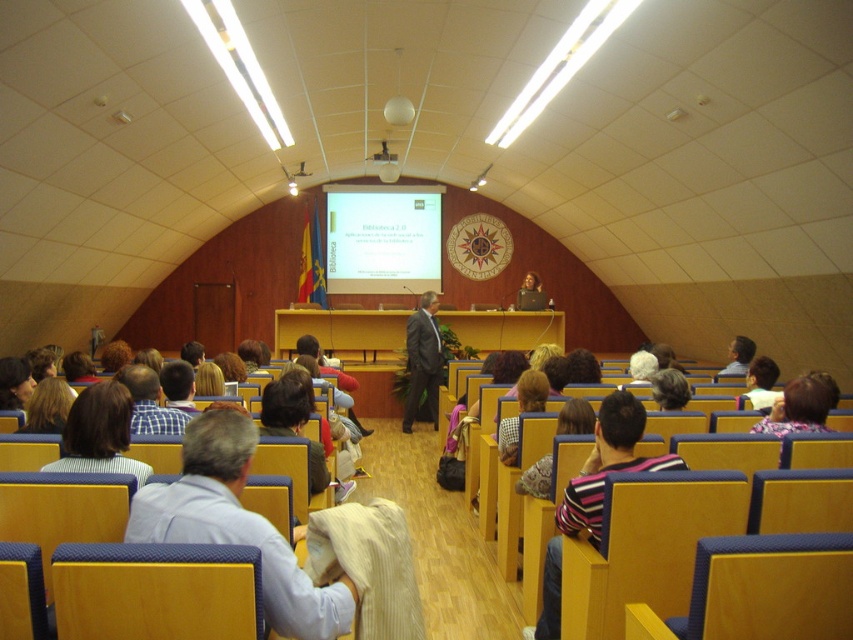
Find the location of `striped shirt at lower left`. striped shirt at lower left is located at coordinates (99, 433).

Describe the element at coordinates (99, 433) in the screenshot. This screenshot has height=640, width=853. I see `striped shirt at lower left` at that location.

The height and width of the screenshot is (640, 853). Find the location of `striped shirt at lower left`. striped shirt at lower left is located at coordinates (99, 433).

The height and width of the screenshot is (640, 853). Find the location of `striped shirt at lower left`. striped shirt at lower left is located at coordinates (99, 433).

Is matte white screen at center positioned behind dark gray suit at center?

That is True.

Can you confirm if matte white screen at center is positioned below dark gray suit at center?

Incorrect, matte white screen at center is not positioned below dark gray suit at center.

Is point (340, 259) closer to viewer compared to point (416, 330)?

No.

Identify the location of matte white screen at center. This screenshot has height=640, width=853. (381, 237).

Can you confirm if matte white screen at center is smaller than striped shirt at lower left?

Actually, matte white screen at center might be larger than striped shirt at lower left.

Which is above, matte white screen at center or striped shirt at lower left?

matte white screen at center is above.

This screenshot has height=640, width=853. What are the coordinates of `matte white screen at center` in the screenshot? It's located at (381, 237).

The image size is (853, 640). In order to click on matte white screen at center in this screenshot , I will do `click(381, 237)`.